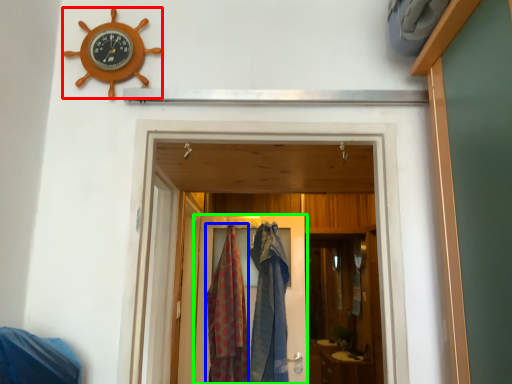
Question: Based on their relative distances, which object is farther from wall clock (highlighted by a red box)? Choose from clothing (highlighted by a blue box) and door (highlighted by a green box).

Choices:
 (A) clothing
 (B) door

Answer: (B)